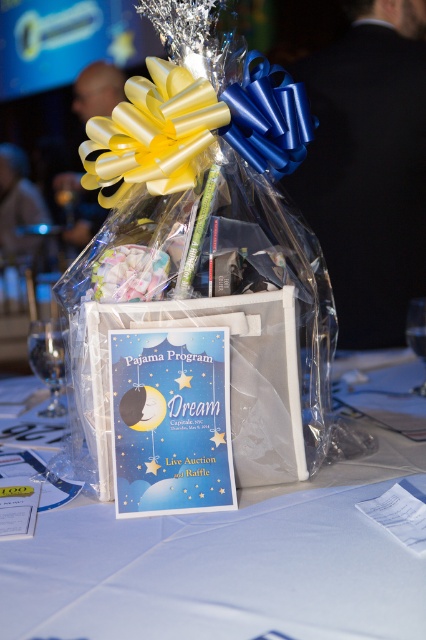
Question: Considering the relative positions of blue satin ribbon at upper center and transparent glass at center in the image provided, where is blue satin ribbon at upper center located with respect to transparent glass at center?

Choices:
 (A) below
 (B) above

Answer: (B)

Question: Which object appears closest to the camera in this image?

Choices:
 (A) transparent glass at lower left
 (B) blue satin ribbon at upper center

Answer: (B)

Question: Which point is farther from the camera taking this photo?

Choices:
 (A) [x=54, y=380]
 (B) [x=425, y=330]
 (C) [x=247, y=125]

Answer: (B)

Question: Estimate the real-world distances between objects in this image. Which object is closer to the yellow satin ribbon at center?

Choices:
 (A) transparent glass at center
 (B) blue satin ribbon at upper center
 (C) blue paperboard at center

Answer: (B)

Question: Is yellow satin ribbon at center to the right of transparent glass at lower left from the viewer's perspective?

Choices:
 (A) no
 (B) yes

Answer: (B)

Question: Can you confirm if pastel fabric flower at center is positioned below transparent glass at center?

Choices:
 (A) yes
 (B) no

Answer: (B)